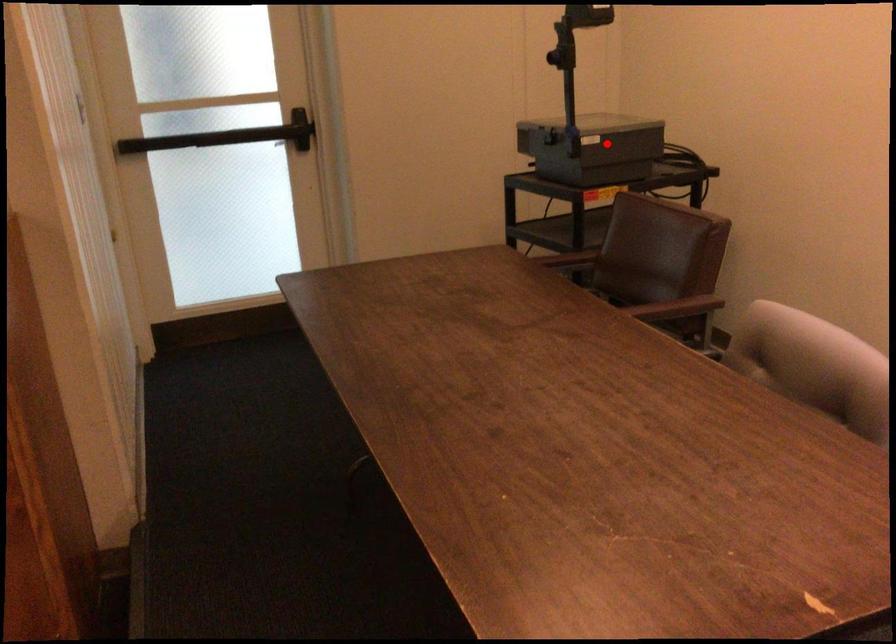
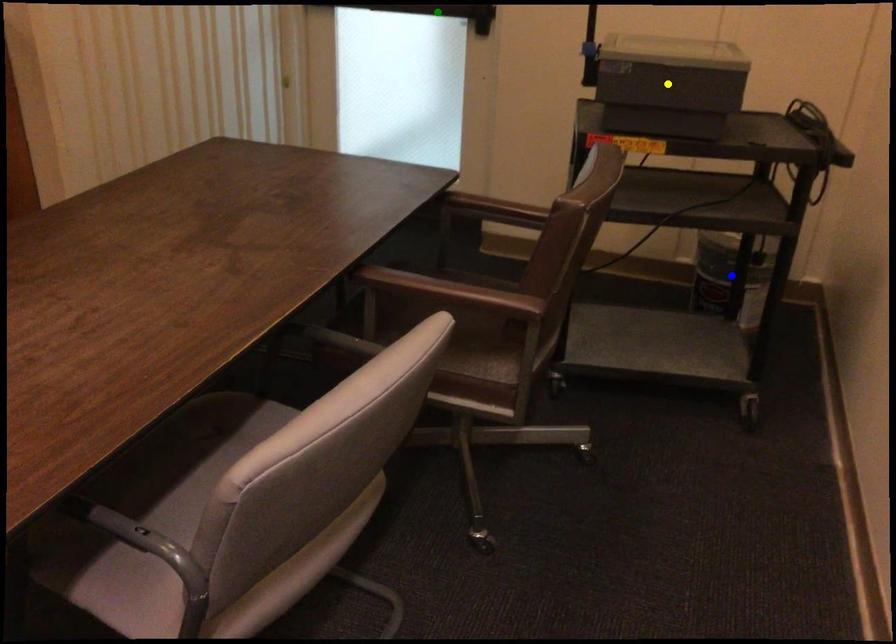
Question: I am providing you with two images of the same scene from different viewpoints. A red point is marked on the first image. You are given multiple points on the second image. Can you choose the point in image 2 that corresponds to the point in image 1?

Choices:
 (A) blue point
 (B) green point
 (C) yellow point

Answer: (C)